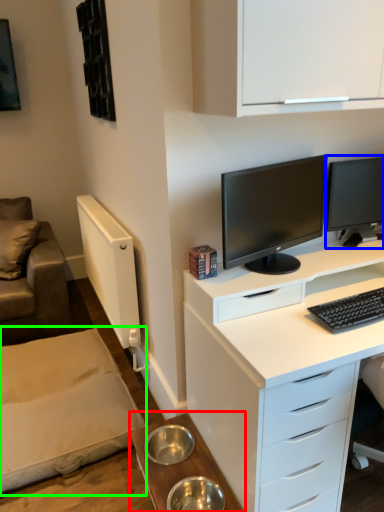
Question: Which is farther away from table (highlighted by a red box)? computer monitor (highlighted by a blue box) or plain (highlighted by a green box)?

Choices:
 (A) computer monitor
 (B) plain

Answer: (A)